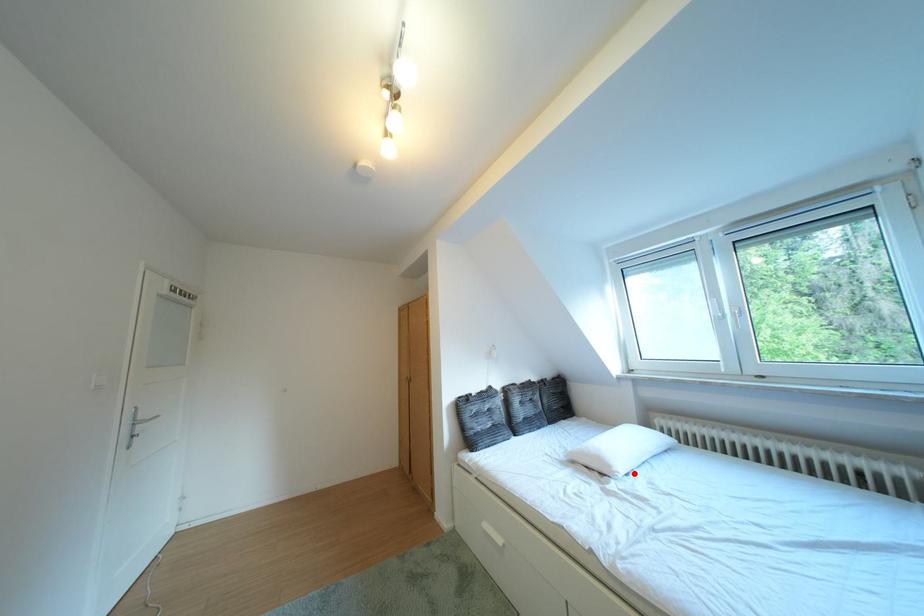
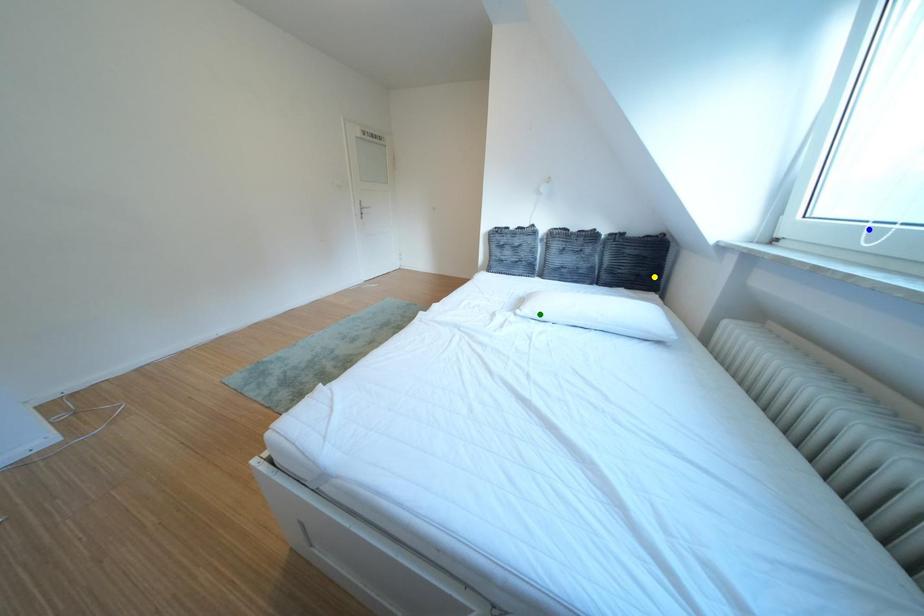
Question: I am providing you with two images of the same scene from different viewpoints. A red point is marked on the first image. You are given multiple points on the second image. In image 2, which mark is for the same physical point as the one in image 1?

Choices:
 (A) green point
 (B) yellow point
 (C) blue point

Answer: (A)